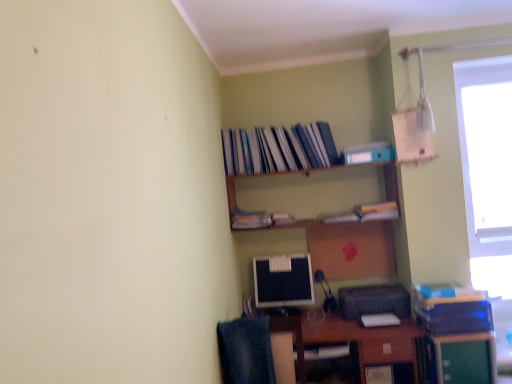
Describe the element at coordinates (374, 301) in the screenshot. I see `black plastic printer at lower right` at that location.

Locate an element on the screen. This screenshot has width=512, height=384. hardcover books at upper center, the 1th book viewed from the top is located at coordinates (278, 149).

You are a GUI agent. You are given a task and a screenshot of the screen. Output one action in this format:
    pyautogui.click(x=<x>, y=<y>)
    Task: Click on the blue matte paperback book at lower right, placed as the second paperback book when sorted from top to bottom
    The image size is (512, 384).
    Given the screenshot: What is the action you would take?
    pyautogui.click(x=456, y=318)

Locate an element on the screen. This screenshot has height=384, width=512. green plastic file cabinet at lower right, the second file cabinet positioned from the bottom is located at coordinates (456, 337).

Describe the element at coordinates (283, 281) in the screenshot. I see `matte black monitor at center` at that location.

This screenshot has width=512, height=384. Describe the element at coordinates (246, 351) in the screenshot. I see `denim at lower left` at that location.

At what (x,y) coordinates should I click in order to perform the action: click on black plastic printer at lower right. Please return your answer as a coordinate pair (x, y). This screenshot has height=384, width=512. Looking at the image, I should click on [374, 301].

Locate an element on the screen. the 2nd file cabinet below the black plastic printer at lower right (from a real-world perspective) is located at coordinates (465, 358).

Is the depth of black plastic printer at lower right less than that of green matte file cabinet at lower right, which ranks as the first file cabinet in bottom-to-top order?

That is False.

Is black plastic printer at lower right with green matte file cabinet at lower right, which ranks as the first file cabinet in bottom-to-top order?

They are not placed beside each other.

Looking at this image, which point is more distant from viewer, (x=490, y=308) or (x=259, y=261)?

The point (x=259, y=261) is farther.

Considering the relative sizes of blue matte paperback book at lower right, the first paperback book in the bottom-to-top sequence, and matte black monitor at center in the image provided, is blue matte paperback book at lower right, the first paperback book in the bottom-to-top sequence, bigger than matte black monitor at center?

Indeed, blue matte paperback book at lower right, the first paperback book in the bottom-to-top sequence, has a larger size compared to matte black monitor at center.

Can matte black monitor at center be found inside blue matte paperback book at lower right, which is counted as the 1th paperback book, starting from the front?

No.

Would you consider blue matte paperback book at lower right, positioned as the 2th paperback book in back-to-front order, to be distant from matte black monitor at center?

No.

Does matte plastic book at center, placed as the 2th book when sorted from top to bottom, have a larger size compared to green matte file cabinet at lower right, marked as the 2th file cabinet in a top-to-bottom arrangement?

No.

From the image's perspective, between matte plastic book at center, the second book when ordered from bottom to top, and green matte file cabinet at lower right, marked as the 2th file cabinet in a top-to-bottom arrangement, which one is located above?

matte plastic book at center, the second book when ordered from bottom to top.

From a real-world perspective, is matte plastic book at center, the second book when ordered from bottom to top, under green matte file cabinet at lower right, which ranks as the first file cabinet in bottom-to-top order?

Incorrect, from a real-world perspective, matte plastic book at center, the second book when ordered from bottom to top, is higher than green matte file cabinet at lower right, which ranks as the first file cabinet in bottom-to-top order.

Which is less distant, (371,294) or (284,216)?

Point (371,294).

From the image's perspective, between black plastic printer at lower right and matte plastic book at center, the second book when ordered from bottom to top, who is located below?

black plastic printer at lower right, from the image's perspective.

Could you tell me if black plastic printer at lower right is facing matte plastic book at center, placed as the 2th book when sorted from top to bottom?

No, black plastic printer at lower right is not oriented towards matte plastic book at center, placed as the 2th book when sorted from top to bottom.

Is black plastic printer at lower right in front of or behind matte plastic book at center, the second book when ordered from bottom to top, in the image?

black plastic printer at lower right is in front of matte plastic book at center, the second book when ordered from bottom to top.

Relative to green plastic file cabinet at lower right, arranged as the 1th file cabinet when viewed from the top, is transparent glass window at upper right in front or behind?

Clearly, transparent glass window at upper right is behind green plastic file cabinet at lower right, arranged as the 1th file cabinet when viewed from the top.

Find the location of `window on the right of the green plastic file cabinet at lower right, the second file cabinet positioned from the bottom`. window on the right of the green plastic file cabinet at lower right, the second file cabinet positioned from the bottom is located at coordinates (487, 168).

Does point (483, 77) lie in front of point (424, 325)?

That is False.

Based on the photo, considering the sizes of objects transparent glass window at upper right and green plastic file cabinet at lower right, arranged as the 1th file cabinet when viewed from the top, in the image provided, who is shorter, transparent glass window at upper right or green plastic file cabinet at lower right, arranged as the 1th file cabinet when viewed from the top,?

green plastic file cabinet at lower right, arranged as the 1th file cabinet when viewed from the top, is shorter.

Considering the sizes of objects denim at lower left and wooden shelf at upper center in the image provided, who is shorter, denim at lower left or wooden shelf at upper center?

wooden shelf at upper center is shorter.

Are denim at lower left and wooden shelf at upper center beside each other?

No, denim at lower left is not with wooden shelf at upper center.

Is the position of denim at lower left more distant than that of wooden shelf at upper center?

No, denim at lower left is in front of wooden shelf at upper center.

Would you say denim at lower left is inside or outside wooden shelf at upper center?

denim at lower left is outside wooden shelf at upper center.

Looking at this image, is the position of black plastic printer at lower right less distant than that of light blue matte paperback book at upper center, which ranks as the 1th paperback book in top-to-bottom order?

Yes.

Does point (360, 287) come in front of point (369, 159)?

Yes, it is in front of point (369, 159).

From the image's perspective, does black plastic printer at lower right appear higher than light blue matte paperback book at upper center, which ranks as the 1th paperback book in top-to-bottom order?

No, from the image's perspective, black plastic printer at lower right is not on top of light blue matte paperback book at upper center, which ranks as the 1th paperback book in top-to-bottom order.

In order to click on the 1st file cabinet in front of the black plastic printer at lower right in this screenshot , I will do `click(465, 358)`.

Image resolution: width=512 pixels, height=384 pixels. What are the coordinates of `computer monitor above the blue matte paperback book at lower right, positioned as the 2th paperback book in back-to-front order (from a real-world perspective)` in the screenshot? It's located at (283, 281).

When comparing their distances from matte black monitor at center, does hardcover book at upper center, positioned as the third book in top-to-bottom order, or light blue matte paperback book at upper center, which is the first paperback book in left-to-right order, seem closer?

hardcover book at upper center, positioned as the third book in top-to-bottom order, lies closer to matte black monitor at center than the other object.

Considering their positions, is hardcover books at upper center, marked as the 3th book in a bottom-to-top arrangement, positioned further to brown wooden desk at lower center than blue matte paperback book at lower right, acting as the second paperback book starting from the left?

The object further to brown wooden desk at lower center is hardcover books at upper center, marked as the 3th book in a bottom-to-top arrangement.

From the image, which object appears to be farther from matte plastic book at center, placed as the 2th book when sorted from top to bottom, hardcover book at upper center, positioned as the third book in top-to-bottom order, or light blue matte paperback book at upper center, which is the 2th paperback book from right to left?

light blue matte paperback book at upper center, which is the 2th paperback book from right to left.

When comparing their distances from denim at lower left, does green plastic file cabinet at lower right, the second file cabinet positioned from the bottom, or hardcover book at upper center, which ranks as the 1th book in bottom-to-top order, seem further?

Based on the image, green plastic file cabinet at lower right, the second file cabinet positioned from the bottom, appears to be further to denim at lower left.

Estimate the real-world distances between objects in this image. Which object is closer to hardcover book at upper center, which ranks as the 1th book in bottom-to-top order, light blue matte paperback book at upper center, placed as the 1th paperback book when sorted from back to front, or green plastic file cabinet at lower right, arranged as the 1th file cabinet when viewed from the top?

light blue matte paperback book at upper center, placed as the 1th paperback book when sorted from back to front, is closer to hardcover book at upper center, which ranks as the 1th book in bottom-to-top order.

Which object lies nearer to the anchor point brown wooden desk at lower center, blue matte paperback book at lower right, placed as the second paperback book when sorted from top to bottom, or transparent glass window at upper right?

blue matte paperback book at lower right, placed as the second paperback book when sorted from top to bottom, is closer to brown wooden desk at lower center.

When comparing their distances from green matte file cabinet at lower right, marked as the 2th file cabinet in a top-to-bottom arrangement, does hardcover books at upper center, marked as the 3th book in a bottom-to-top arrangement, or hardcover book at upper center, positioned as the third book in top-to-bottom order, seem closer?

Based on the image, hardcover book at upper center, positioned as the third book in top-to-bottom order, appears to be nearer to green matte file cabinet at lower right, marked as the 2th file cabinet in a top-to-bottom arrangement.

Which object lies nearer to the anchor point matte plastic book at center, the second book when ordered from bottom to top, wooden shelf at upper center or hardcover books at upper center, marked as the 3th book in a bottom-to-top arrangement?

Among the two, wooden shelf at upper center is located nearer to matte plastic book at center, the second book when ordered from bottom to top.

Identify the location of book between matte black monitor at center and black plastic printer at lower right. point(283,219).

The image size is (512, 384). I want to click on shelf between light blue matte paperback book at upper center, the 2th paperback book in the front-to-back sequence, and brown wooden desk at lower center, in the vertical direction, so click(x=312, y=196).

You are a GUI agent. You are given a task and a screenshot of the screen. Output one action in this format:
    pyautogui.click(x=<x>, y=<y>)
    Task: Click on the printer between brown wooden desk at lower center and green plastic file cabinet at lower right, the second file cabinet positioned from the bottom, in the horizontal direction
    This screenshot has height=384, width=512.
    Given the screenshot: What is the action you would take?
    coord(374,301)

Find the location of a particular element. Image resolution: width=512 pixels, height=384 pixels. shelf situated between hardcover books at upper center, the 1th book viewed from the top, and blue matte paperback book at lower right, the first paperback book in the bottom-to-top sequence, from left to right is located at coordinates (312, 196).